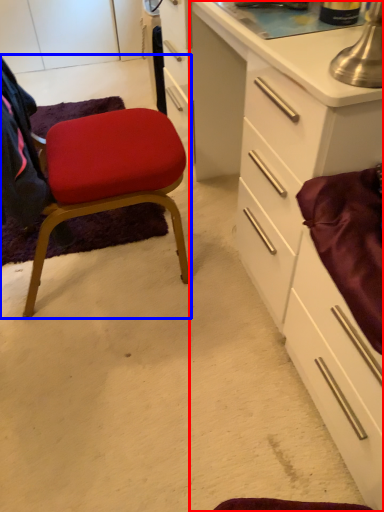
Question: Which object is further to the camera taking this photo, cabinetry (highlighted by a red box) or chair (highlighted by a blue box)?

Choices:
 (A) cabinetry
 (B) chair

Answer: (B)